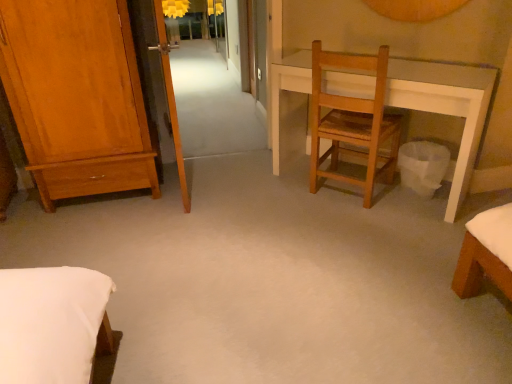
Question: From a real-world perspective, is wooden chair at center below transparent glass screen door at upper left?

Choices:
 (A) yes
 (B) no

Answer: (A)

Question: Considering the relative sizes of wooden chair at center and transparent glass screen door at upper left in the image provided, is wooden chair at center smaller than transparent glass screen door at upper left?

Choices:
 (A) yes
 (B) no

Answer: (B)

Question: Considering the relative sizes of wooden chair at center and transparent glass screen door at upper left in the image provided, is wooden chair at center thinner than transparent glass screen door at upper left?

Choices:
 (A) no
 (B) yes

Answer: (A)

Question: From the image's perspective, does wooden chair at center appear lower than transparent glass screen door at upper left?

Choices:
 (A) no
 (B) yes

Answer: (B)

Question: Is wooden chair at center closer to camera compared to transparent glass screen door at upper left?

Choices:
 (A) no
 (B) yes

Answer: (A)

Question: Is wooden chair at center at the left side of transparent glass screen door at upper left?

Choices:
 (A) no
 (B) yes

Answer: (A)

Question: From a real-world perspective, is shiny brown wardrobe at left physically above matte yellow lampshade at upper center?

Choices:
 (A) yes
 (B) no

Answer: (A)

Question: From the image's perspective, is shiny brown wardrobe at left over matte yellow lampshade at upper center?

Choices:
 (A) no
 (B) yes

Answer: (A)

Question: Can you confirm if shiny brown wardrobe at left is positioned to the right of matte yellow lampshade at upper center?

Choices:
 (A) yes
 (B) no

Answer: (A)

Question: From a real-world perspective, is shiny brown wardrobe at left positioned under matte yellow lampshade at upper center based on gravity?

Choices:
 (A) no
 (B) yes

Answer: (A)

Question: Does shiny brown wardrobe at left have a lesser width compared to matte yellow lampshade at upper center?

Choices:
 (A) yes
 (B) no

Answer: (A)

Question: Does shiny brown wardrobe at left lie in front of matte yellow lampshade at upper center?

Choices:
 (A) no
 (B) yes

Answer: (B)

Question: Can we say matte yellow lampshade at upper center lies outside wooden chair at center?

Choices:
 (A) no
 (B) yes

Answer: (B)